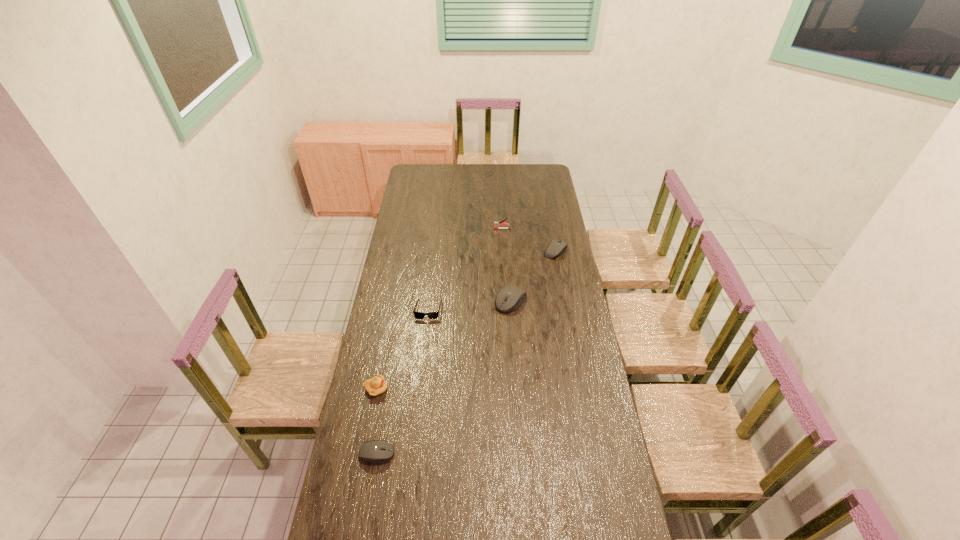
To achieve even spacing by inserting another mouse_(computer_equipment) among them, please point to a vacant spot for this new mouse_(computer_equipment). Please provide its 2D coordinates. Your answer should be formatted as a tuple, i.e. [(x, y)], where the tuple contains the x and y coordinates of a point satisfying the conditions above.

[(454, 366)]